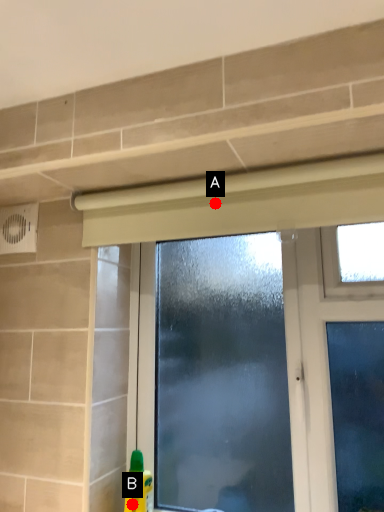
Question: Two points are circled on the image, labeled by A and B beside each circle. Which of the following is the farthest from the observer?

Choices:
 (A) A is further
 (B) B is further

Answer: (B)